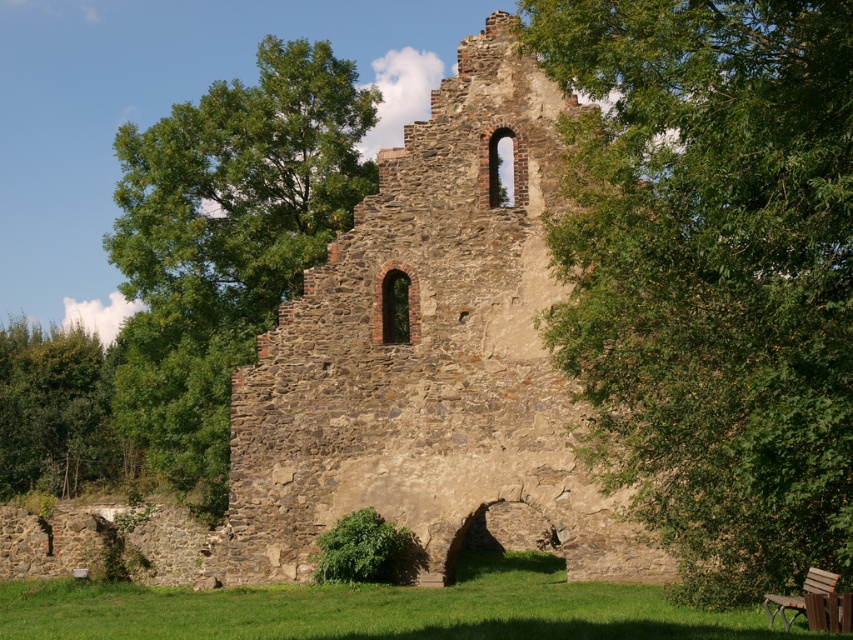
You are standing at the ruins of an old stone structure. You notice two points marked on the wall. The first point is at coordinate (799, 416) and the second is at (782, 616). From your perspective, which point is closer to you?

Point (799, 416) is in front of point (782, 616), so it is closer to you.

You are standing at the center of the ruins and want to sit down. Which object should you approach to reach the wooden bench at lower right first if you move towards the green leafy tree at left first?

If you first move towards the green leafy tree at left, which is to the left of the wooden bench at lower right, you would need to go past the bench to reach the tree. Therefore, you would encounter the wooden bench at lower right first on your way to the tree.

You are standing at the entrance of the ruins and want to sit on the wooden bench at lower right. Is the green leafy tree at center blocking your path to the bench?

The green leafy tree at center is in front of the wooden bench at lower right, so it is blocking the path to the bench.